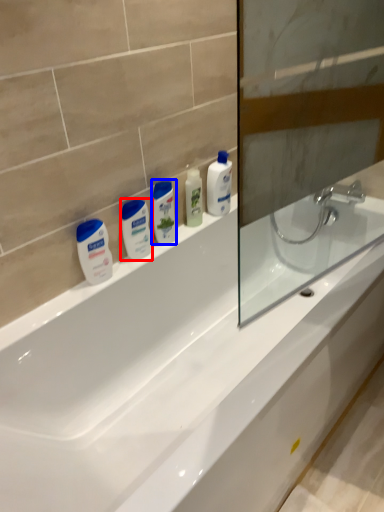
Question: Which object is further to the camera taking this photo, mouthwash (highlighted by a red box) or mouthwash (highlighted by a blue box)?

Choices:
 (A) mouthwash
 (B) mouthwash

Answer: (B)